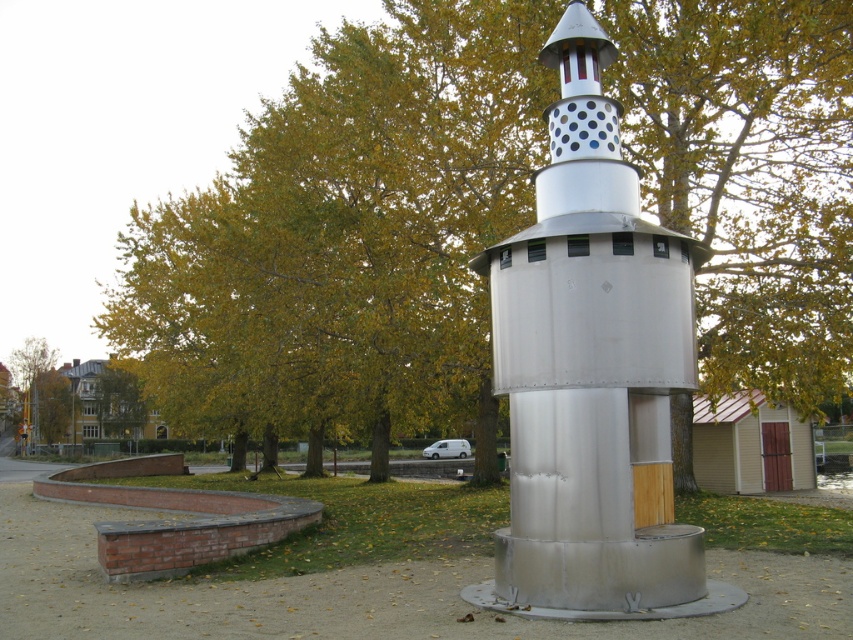
Question: Is green leafy tree at center to the left of metallic silver tower at center from the viewer's perspective?

Choices:
 (A) yes
 (B) no

Answer: (A)

Question: Which point is closer to the camera?

Choices:
 (A) metallic silver tower at center
 (B) green leafy tree at center
 (C) green leafy tree at upper left

Answer: (A)

Question: Based on their relative distances, which object is nearer to the green leafy tree at center?

Choices:
 (A) green leafy tree at upper left
 (B) metallic silver tower at center

Answer: (B)

Question: Which of the following is the farthest from the observer?

Choices:
 (A) metallic silver tower at center
 (B) green leafy tree at center

Answer: (B)

Question: Can you confirm if green leafy tree at center is thinner than metallic silver tower at center?

Choices:
 (A) yes
 (B) no

Answer: (B)

Question: Is green leafy tree at center to the right of metallic silver tower at center from the viewer's perspective?

Choices:
 (A) yes
 (B) no

Answer: (B)